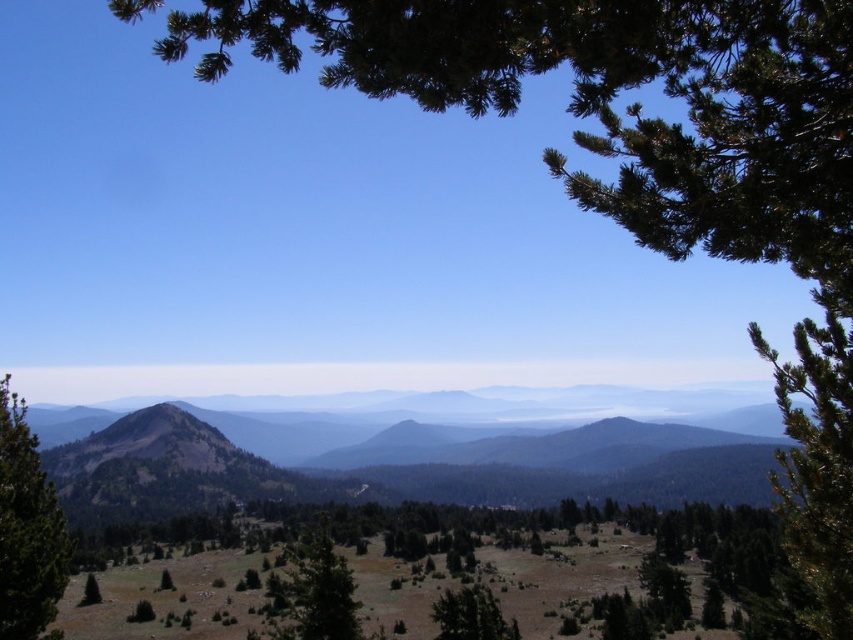
Question: Is the position of brown textured mountain at center less distant than that of green textured tree at left?

Choices:
 (A) no
 (B) yes

Answer: (A)

Question: Which point is farther to the camera?

Choices:
 (A) green matte tree at lower center
 (B) brown textured mountain at center
 (C) green matte tree at center
 (D) green matte tree at lower left

Answer: (B)

Question: Is brown textured mountain at center to the left of green matte tree at lower left from the viewer's perspective?

Choices:
 (A) no
 (B) yes

Answer: (B)

Question: Which point is closer to the camera?

Choices:
 (A) (97, 593)
 (B) (320, 518)
 (C) (494, 636)

Answer: (C)

Question: Can you confirm if green matte tree at center is bigger than green matte tree at lower left?

Choices:
 (A) yes
 (B) no

Answer: (A)

Question: Which is nearer to the green textured tree at left?

Choices:
 (A) brown textured mountain at center
 (B) green matte tree at center
 (C) green matte tree at lower left

Answer: (B)